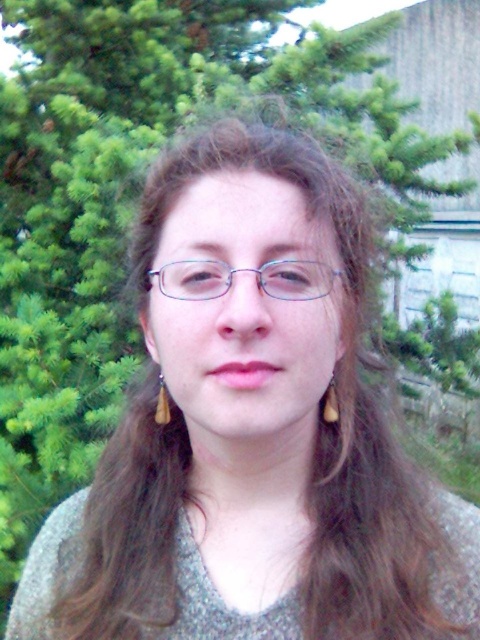
From the picture: You are a photographer trying to capture a closeup of the clear plastic glasses at center and the brown leather earring at left. Your camera has a focus range of 4 inches. Can you focus on both objects simultaneously?

The distance between the clear plastic glasses at center and brown leather earring at left is 4.75 inches. Since the camera can only focus within 4 inches, you cannot focus on both objects at the same time.

You are standing at the point with coordinates point (164, 396) and want to move to the point (311, 266). Considering the spatial arrangement in the scene, will you have to walk around any obstacles or can you move directly towards your destination?

Since point (311, 266) is in front of point (164, 396), you can move directly towards your destination without needing to walk around any obstacles.

You are standing in front of a person wearing large earrings and a V neck sweater. There is a point at coordinates point (x=328, y=288). Can you tell me how far this point is from your eyes?

The point at point (x=328, y=288) is 44.78 centimeters away from the viewer.